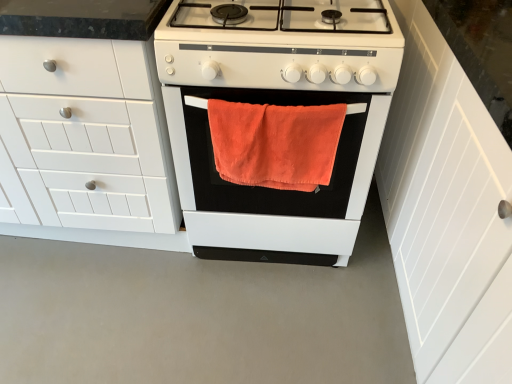
I want to click on vacant area that is in front of white matte oven at center, so click(x=252, y=323).